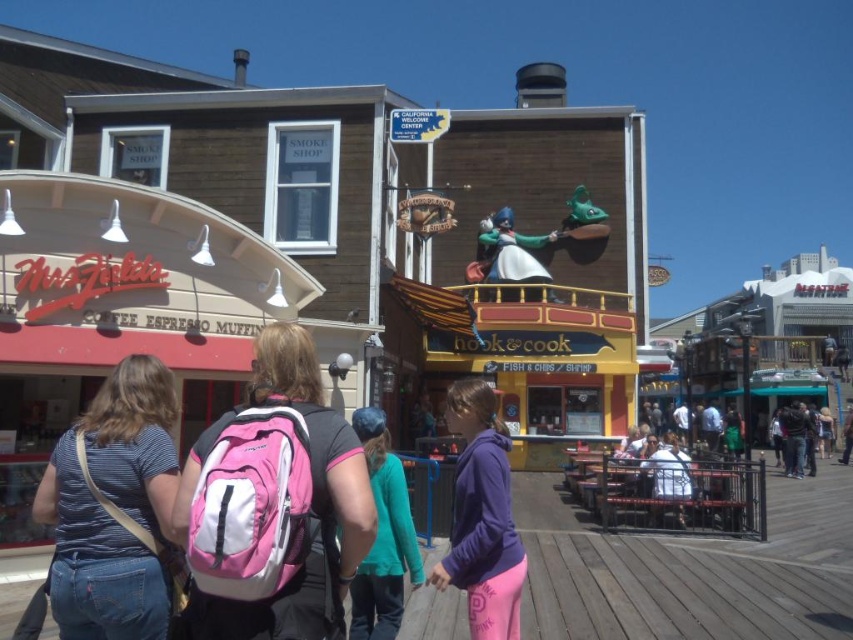
You are a photographer trying to capture a photo of the boardwalk scene. You notice two pairs of jeans in the frame. The denim jeans at lower left and the dark blue jeans at center. Which pair of jeans is narrower in width?

The denim jeans at lower left has a lesser width compared to dark blue jeans at center, so the denim jeans at lower left is narrower in width.

You are a photographer trying to capture a candid shot of the two people in the scene. You notice the pink fabric backpack at center and the white fabric shirt at center. Which object should you focus on to ensure it takes up more of the frame?

The white fabric shirt at center occupies more space than the pink fabric backpack at center, so focusing on the white fabric shirt at center would ensure it takes up more of the frame.

You are a photographer trying to capture the pink fabric backpack at center and the white fabric shirt at center in a single shot. Since you want both items to be clearly visible, which object should you focus on to ensure the taller one is in focus first?

The pink fabric backpack at center is taller than the white fabric shirt at center, so you should focus on the pink fabric backpack at center first to ensure it is in focus.